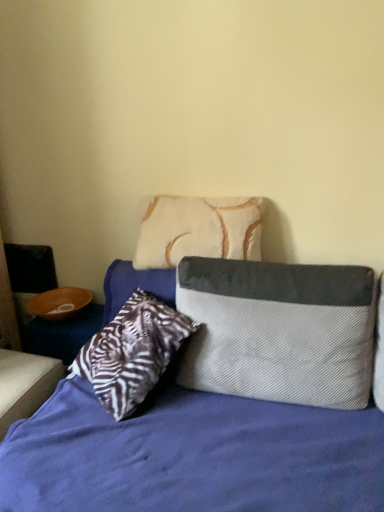
Question: Is textured gray and white pillow at center in front of or behind white fur pillow at upper center, which is the 1th pillow in top-to-bottom order, in the image?

Choices:
 (A) front
 (B) behind

Answer: (A)

Question: Based on their positions, is textured gray and white pillow at center located to the left or right of white fur pillow at upper center, which is counted as the 2th pillow, starting from the bottom?

Choices:
 (A) right
 (B) left

Answer: (A)

Question: Based on their relative distances, which object is farther from the textured gray pillow at center, positioned as the 2th pillow in top-to-bottom order?

Choices:
 (A) white fur pillow at upper center, which is counted as the 2th pillow, starting from the bottom
 (B) textured gray and white pillow at center

Answer: (A)

Question: Based on their relative distances, which object is nearer to the textured gray pillow at center, arranged as the 1th pillow when ordered from the bottom?

Choices:
 (A) textured gray and white pillow at center
 (B) white fur pillow at upper center, which is the 1th pillow in top-to-bottom order

Answer: (A)